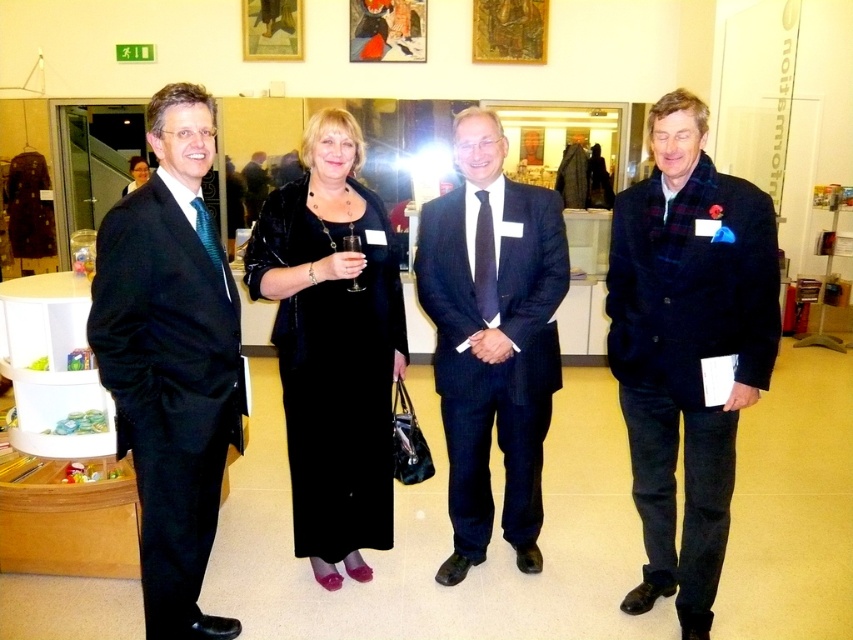
Question: Which point is farther to the camera?

Choices:
 (A) velvet black blazer at right
 (B) shiny black suit at left
 (C) dark blue suit at center

Answer: (C)

Question: Which point appears farthest from the camera in this image?

Choices:
 (A) (457, 163)
 (B) (323, 448)
 (C) (733, 253)
 (D) (283, 29)

Answer: (D)

Question: Can you confirm if shiny black suit at left is bigger than dark blue suit at center?

Choices:
 (A) yes
 (B) no

Answer: (B)

Question: Is dark blue suit at center thinner than black velvet dress at center?

Choices:
 (A) yes
 (B) no

Answer: (B)

Question: Is dark blue suit at center to the left of black velvet dress at center from the viewer's perspective?

Choices:
 (A) yes
 (B) no

Answer: (B)

Question: Which of the following is the farthest from the observer?

Choices:
 (A) (663, 282)
 (B) (338, 344)
 (C) (135, 330)

Answer: (B)